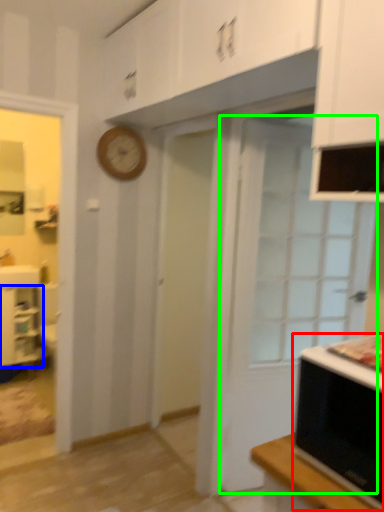
Question: Estimate the real-world distances between objects in this image. Which object is closer to microwave oven (highlighted by a red box), cabinetry (highlighted by a blue box) or door (highlighted by a green box)?

Choices:
 (A) cabinetry
 (B) door

Answer: (B)